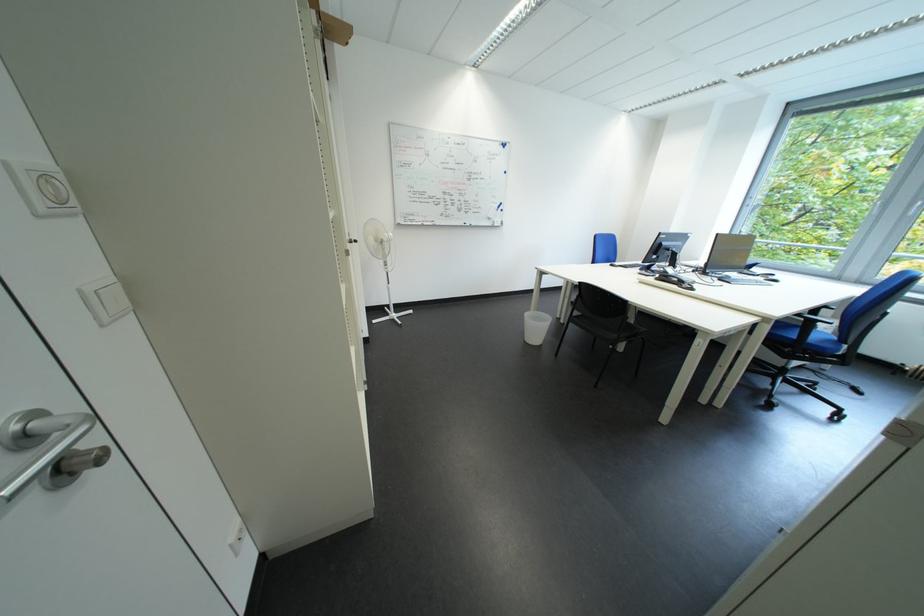
The image size is (924, 616). Describe the element at coordinates (807, 339) in the screenshot. I see `a blue chair sitting surface` at that location.